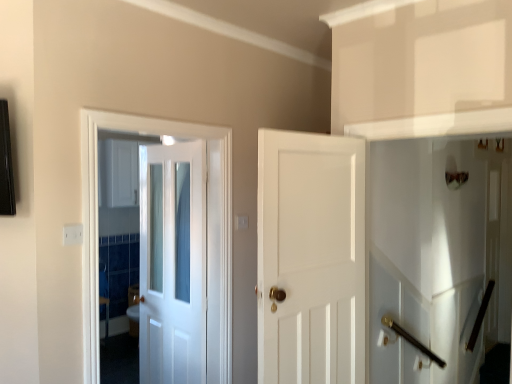
Question: Is white glossy cabinet at upper left bigger or smaller than polished brass door handle at lower right?

Choices:
 (A) big
 (B) small

Answer: (A)

Question: Does point (103, 145) appear closer or farther from the camera than point (480, 314)?

Choices:
 (A) closer
 (B) farther

Answer: (B)

Question: Estimate the real-world distances between objects in this image. Which object is closer to the white plastic electric outlet at lower left?

Choices:
 (A) white glossy elevator at right
 (B) polished brass door handle at lower right
 (C) white glossy door at center, the second door positioned from the right
 (D) white glossy door at center, placed as the 3th door when sorted from left to right
 (E) white glossy cabinet at upper left

Answer: (C)

Question: Which object is positioned closest to the white glossy door at center, placed as the 3th door when sorted from left to right?

Choices:
 (A) white glossy door at center, which appears as the third door when viewed from the right
 (B) white plastic electric outlet at lower left
 (C) white glossy cabinet at upper left
 (D) polished brass door handle at lower right
 (E) white glossy elevator at right

Answer: (A)